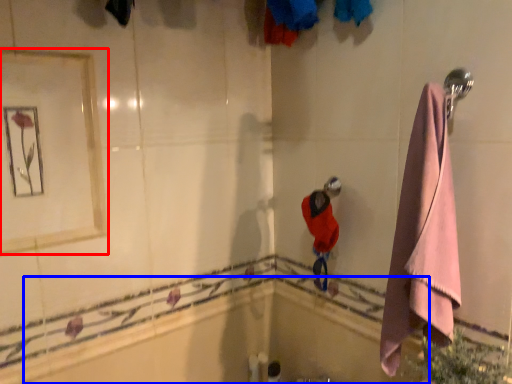
Question: Which object is further to the camera taking this photo, mirror (highlighted by a red box) or bath (highlighted by a blue box)?

Choices:
 (A) mirror
 (B) bath

Answer: (B)